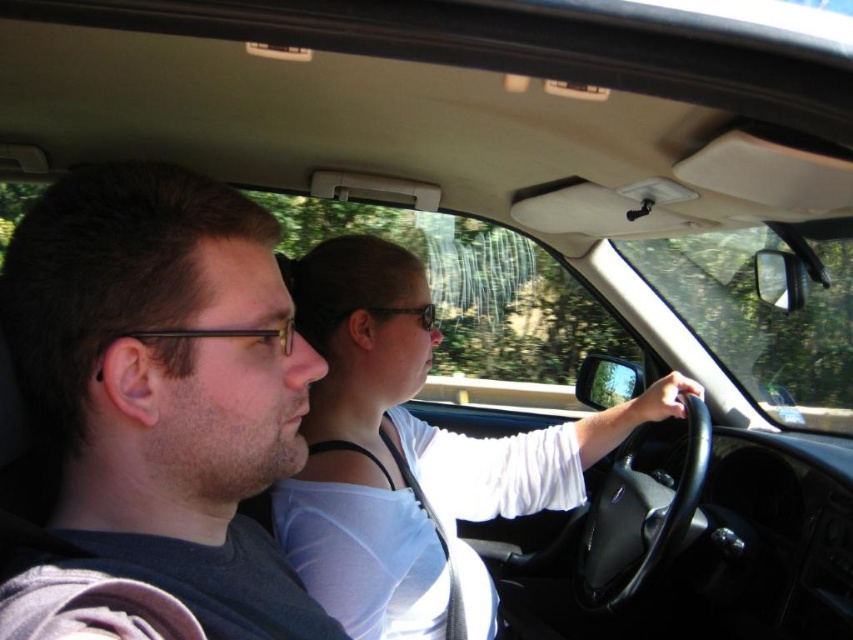
Question: Is the position of dark gray fabric shirt at left more distant than that of matte black shirt at center?

Choices:
 (A) no
 (B) yes

Answer: (A)

Question: Is dark gray fabric shirt at left thinner than matte black shirt at center?

Choices:
 (A) no
 (B) yes

Answer: (B)

Question: Which point is closer to the camera?

Choices:
 (A) (322, 328)
 (B) (267, 563)

Answer: (B)

Question: Can you confirm if dark gray fabric shirt at left is positioned to the right of matte black shirt at center?

Choices:
 (A) yes
 (B) no

Answer: (B)

Question: Which of the following is the farthest from the observer?

Choices:
 (A) matte black shirt at center
 (B) dark gray fabric shirt at left

Answer: (A)